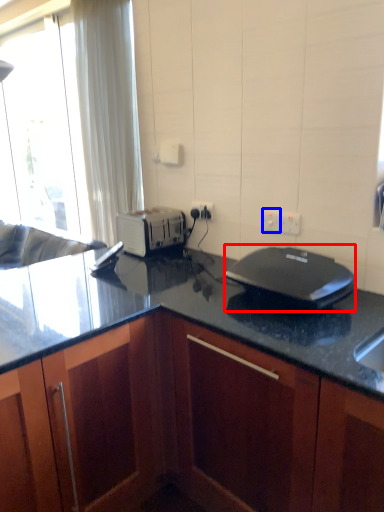
Question: Which of the following is the farthest to the observer, home appliance (highlighted by a red box) or electric outlet (highlighted by a blue box)?

Choices:
 (A) home appliance
 (B) electric outlet

Answer: (B)